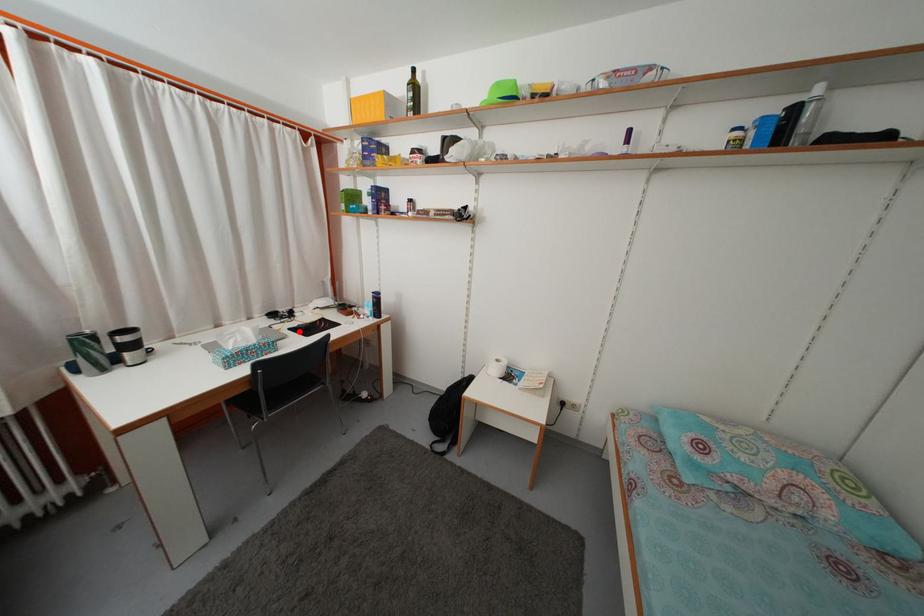
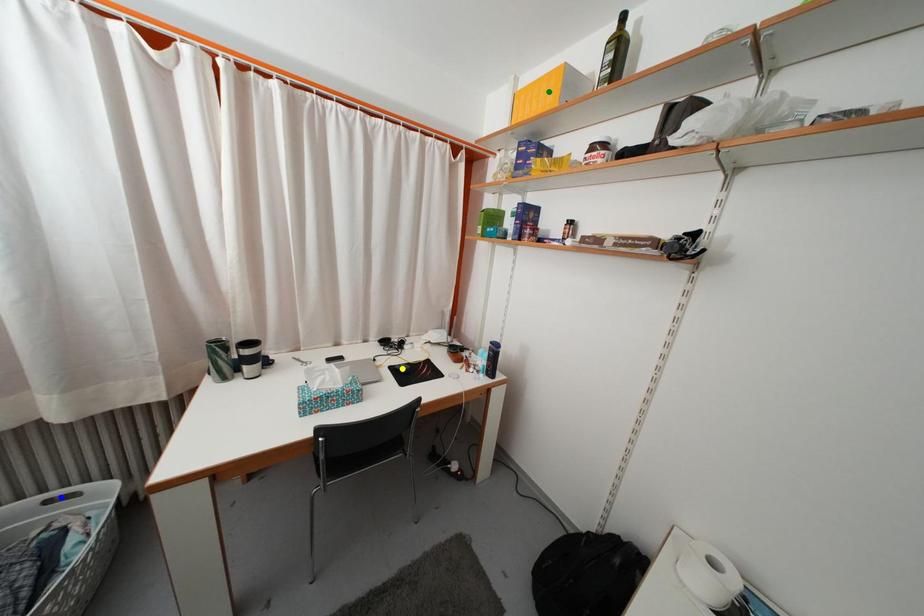
Question: I am providing you with two images of the same scene from different viewpoints. A red point is marked on the first image. You are given multiple points on the second image. Can you choose the point in image 2 that corresponds to the point in image 1?

Choices:
 (A) green point
 (B) blue point
 (C) yellow point

Answer: (C)